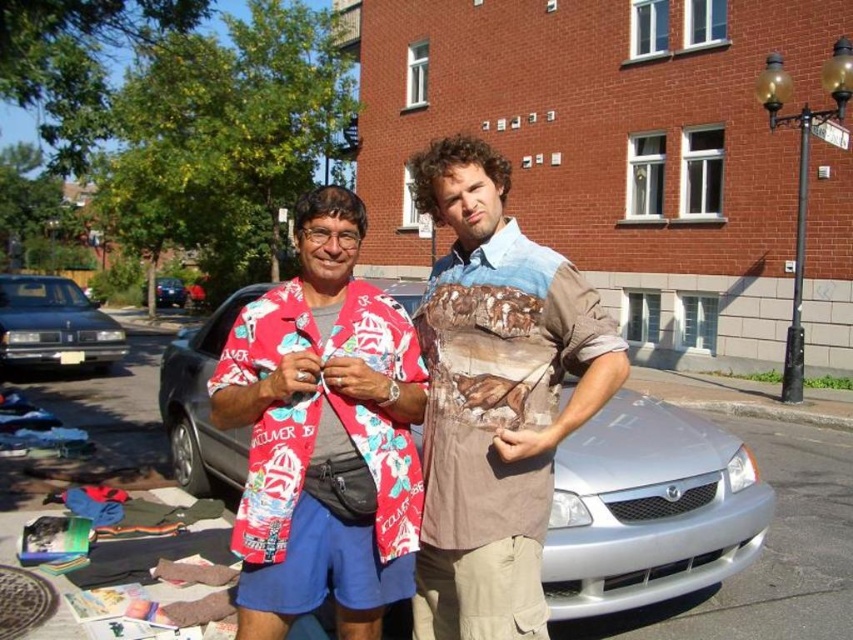
You are a photographer taking a picture of two points in the scene described. The points are labeled as point 1 at coordinates point [268,497] and point 2 at coordinates point [183,291]. Which point is closer to the camera?

Point 1 at coordinates point [268,497] is closer to the camera than point 2 at coordinates point [183,291].

You are a delivery person who needs to park your vehicle next to the two sedans. You have a compact car that is 4 meters long. Can your car fit between the matte black sedan at left and the shiny black sedan at left if there is only 4.5 meters of space available?

The matte black sedan at left is larger in size than the shiny black sedan at left. Since the total space available is 4.5 meters and your compact car is 4 meters long, there would be 0.5 meters of space remaining. This should be sufficient as the difference in size between the two sedans likely allows for the car to fit within the available space.